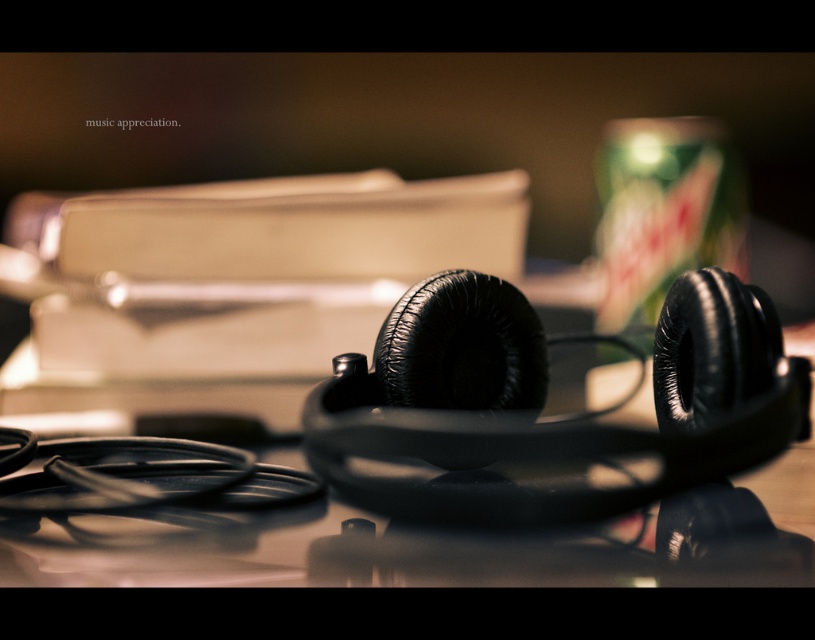
Question: In this image, where is black matte headphones at center located relative to green matte can at upper right?

Choices:
 (A) below
 (B) above

Answer: (A)

Question: Which object appears farthest from the camera in this image?

Choices:
 (A) black matte headphones at center
 (B) green matte can at upper right

Answer: (B)

Question: Can you confirm if black matte headphones at center is positioned below green matte can at upper right?

Choices:
 (A) no
 (B) yes

Answer: (B)

Question: Is black matte headphones at center bigger than green matte can at upper right?

Choices:
 (A) yes
 (B) no

Answer: (A)